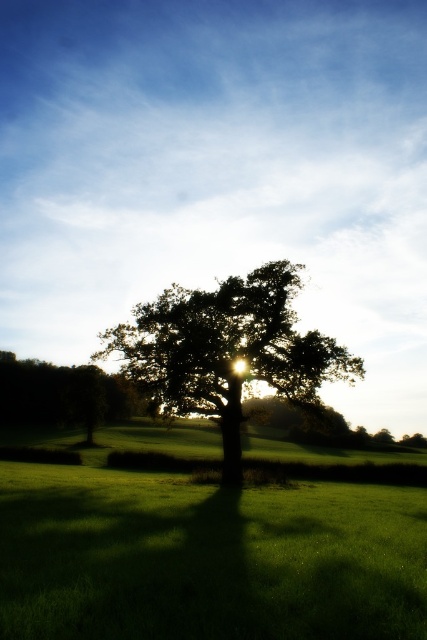
You are standing at the point with coordinates point (x=204, y=552). What is the terrain like at your current location?

The point (x=204, y=552) corresponds to green grass at center, so the terrain is green grass.

You are standing in the middle of the green grass at center and want to reach the dark green leafy oak tree at center. Since both are at the center, how do you decide which direction to walk to reach the tree?

The dark green leafy oak tree at center is smaller than the green grass at center, so you should walk towards the area where the tree occupies less space relative to the grass to find it.

You are standing in the middle of the green grass at center and want to walk towards the dark green leafy oak tree at center. Which direction should you head?

The green grass at center is to the right of dark green leafy oak tree at center, so you should head to the left to reach the tree.